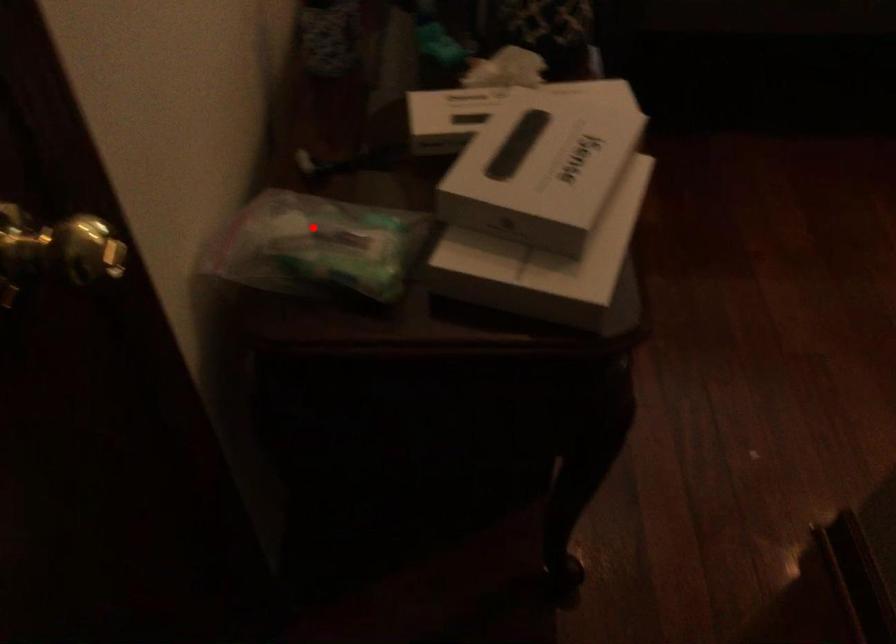
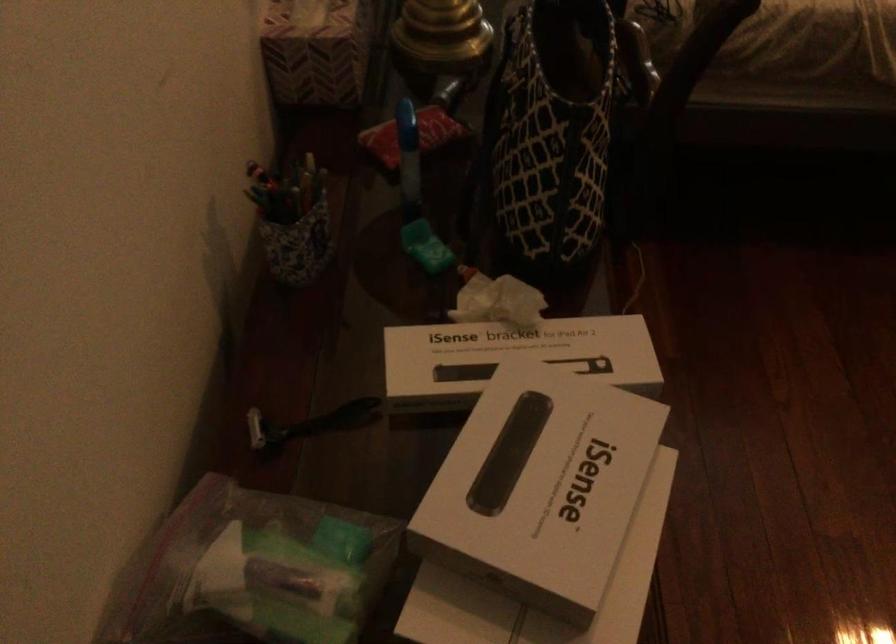
Question: I am providing you with two images of the same scene from different viewpoints. Image1 has a red point marked. In image2, the corresponding 3D location appears at what relative position? Reply with the corresponding letter.

Choices:
 (A) Closer
 (B) Farther

Answer: (A)